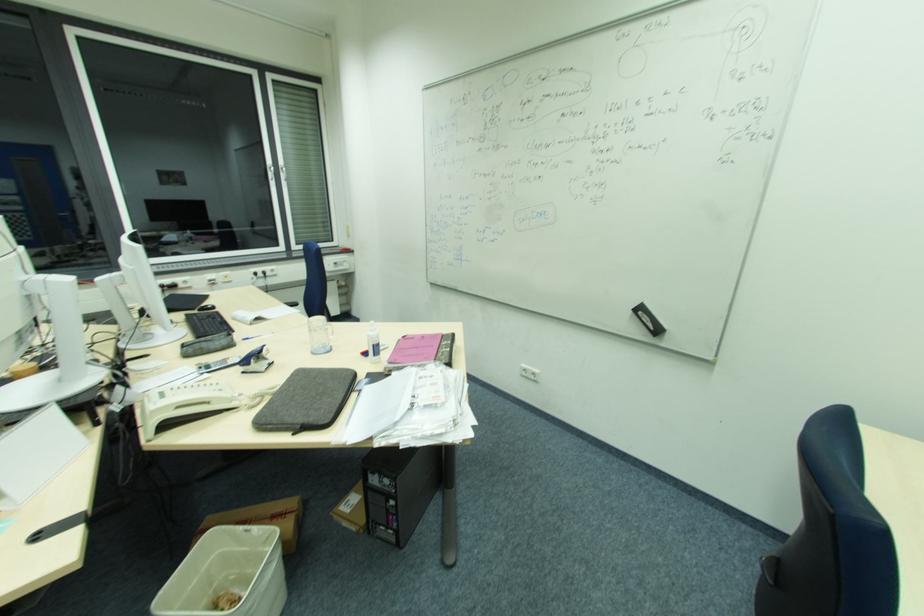
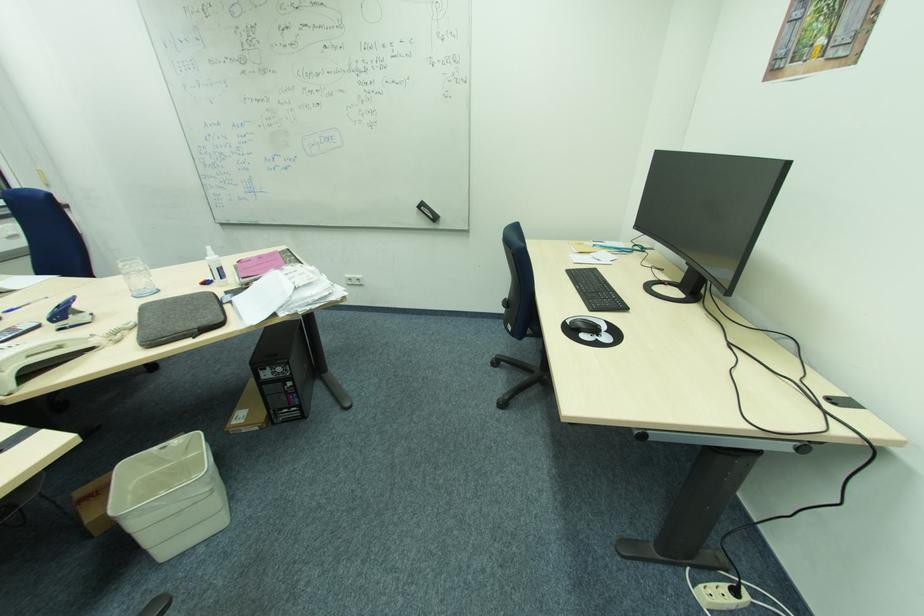
Find the pixel in the second image that matches the point at 375,345 in the first image.

(221, 268)